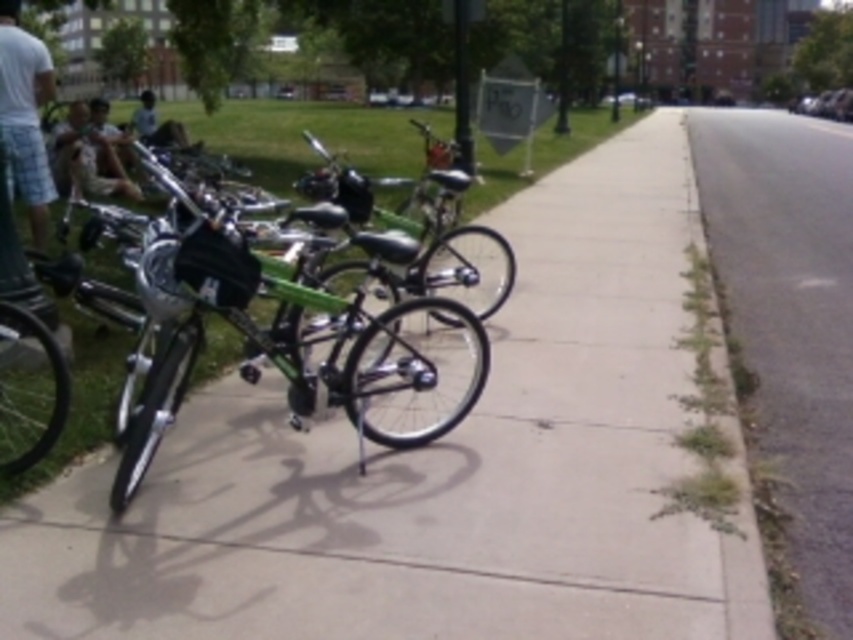
Question: Which of these objects is positioned farthest from the white cotton t-shirt at left?

Choices:
 (A) green grass at lower right
 (B) dark blue jeans at center

Answer: (B)

Question: Can you confirm if green matte bicycle at center is positioned above camouflage fabric backpack at left?

Choices:
 (A) no
 (B) yes

Answer: (A)

Question: Is the position of smooth concrete sidewalk at center less distant than that of camouflage fabric backpack at left?

Choices:
 (A) no
 (B) yes

Answer: (B)

Question: Considering the relative positions of green matte bicycle at center and green fabric backpack at center in the image provided, where is green matte bicycle at center located with respect to green fabric backpack at center?

Choices:
 (A) left
 (B) right

Answer: (B)

Question: Which is nearer to the dark blue jeans at center?

Choices:
 (A) green fabric backpack at center
 (B) smooth concrete sidewalk at center
 (C) camouflage fabric backpack at left

Answer: (A)

Question: Which object appears closest to the camera in this image?

Choices:
 (A) smooth concrete sidewalk at center
 (B) green fabric backpack at center

Answer: (A)